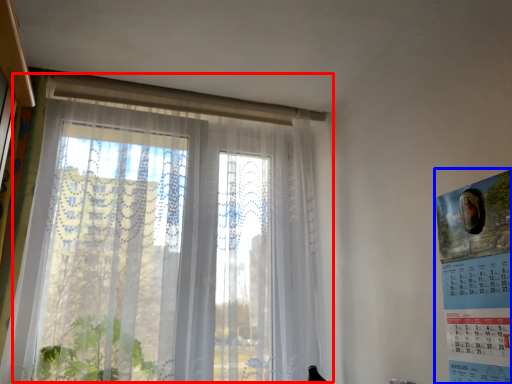
Question: Which of the following is the farthest to the observer, window (highlighted by a red box) or poster page (highlighted by a blue box)?

Choices:
 (A) window
 (B) poster page

Answer: (A)